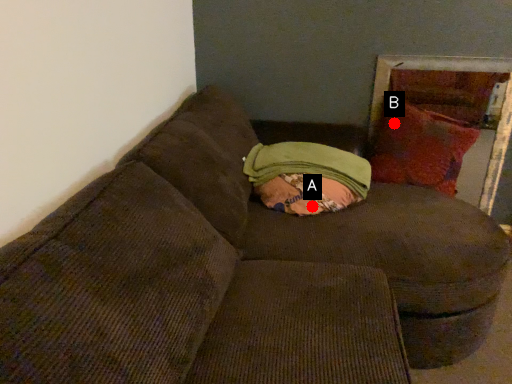
Question: Two points are circled on the image, labeled by A and B beside each circle. Which point appears farthest from the camera in this image?

Choices:
 (A) A is further
 (B) B is further

Answer: (B)